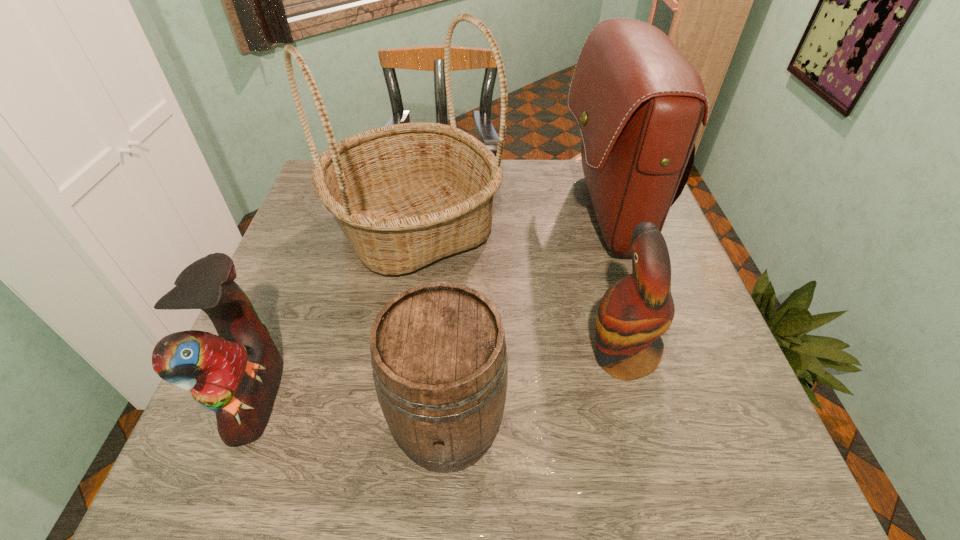
In order to click on basket in this screenshot , I will do point(406,195).

Find the location of a particular element. The image size is (960, 540). satchel is located at coordinates (638, 101).

Where is `the right parrot`? The image size is (960, 540). the right parrot is located at coordinates (634, 313).

Image resolution: width=960 pixels, height=540 pixels. In order to click on the left parrot in this screenshot , I will do `click(237, 373)`.

Find the location of a particular element. cider is located at coordinates (438, 352).

At what (x,y) coordinates should I click in order to perform the action: click on free spot located on the right of the basket. Please return your answer as a coordinate pair (x, y). The image size is (960, 540). Looking at the image, I should click on (598, 228).

Identify the location of free location located 0.070m on the open flap of the satchel. (537, 214).

The height and width of the screenshot is (540, 960). I want to click on vacant region located on the open flap of the satchel, so click(540, 214).

Find the location of `vacant space located 0.200m on the open flap of the satchel`. vacant space located 0.200m on the open flap of the satchel is located at coordinates (488, 214).

I want to click on blank area located 0.250m on the face of the right parrot, so click(458, 355).